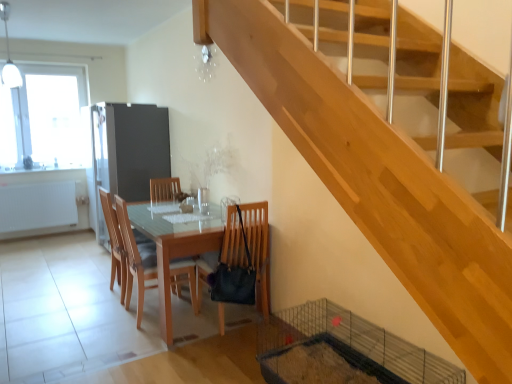
Question: Is wooden chair at center, the 2th chair in the right-to-left sequence, located outside matte wooden table at center?

Choices:
 (A) yes
 (B) no

Answer: (B)

Question: Is wooden chair at center, the 2th chair in the right-to-left sequence, facing away from matte wooden table at center?

Choices:
 (A) yes
 (B) no

Answer: (A)

Question: From a real-world perspective, is wooden chair at center, the 2th chair in the right-to-left sequence, physically below matte wooden table at center?

Choices:
 (A) yes
 (B) no

Answer: (B)

Question: Is wooden chair at center, the 2th chair from the left, far away from matte wooden table at center?

Choices:
 (A) yes
 (B) no

Answer: (B)

Question: Considering the relative sizes of wooden chair at center, the 2th chair in the right-to-left sequence, and matte wooden table at center in the image provided, is wooden chair at center, the 2th chair in the right-to-left sequence, shorter than matte wooden table at center?

Choices:
 (A) yes
 (B) no

Answer: (B)

Question: From a real-world perspective, is wooden chair at center, the 2th chair from the left, physically located above or below transparent glass window at upper left?

Choices:
 (A) above
 (B) below

Answer: (B)

Question: In terms of height, does wooden chair at center, the 2th chair in the right-to-left sequence, look taller or shorter compared to transparent glass window at upper left?

Choices:
 (A) short
 (B) tall

Answer: (A)

Question: Considering the relative positions of wooden chair at center, the 2th chair from the left, and transparent glass window at upper left in the image provided, is wooden chair at center, the 2th chair from the left, to the left or to the right of transparent glass window at upper left?

Choices:
 (A) right
 (B) left

Answer: (A)

Question: Looking at the image, does wooden chair at center, the 2th chair in the right-to-left sequence, seem bigger or smaller compared to transparent glass window at upper left?

Choices:
 (A) big
 (B) small

Answer: (B)

Question: Would you say wooden chair at center, which is counted as the third chair, starting from the right, is to the left or to the right of metallic silver screen door at center left in the picture?

Choices:
 (A) right
 (B) left

Answer: (A)

Question: From a real-world perspective, is wooden chair at center, which is counted as the third chair, starting from the right, positioned above or below metallic silver screen door at center left?

Choices:
 (A) above
 (B) below

Answer: (B)

Question: Considering the positions of point (113, 281) and point (160, 165), is point (113, 281) closer or farther from the camera than point (160, 165)?

Choices:
 (A) farther
 (B) closer

Answer: (B)

Question: Is wooden chair at center, placed as the 1th chair when sorted from left to right, taller or shorter than metallic silver screen door at center left?

Choices:
 (A) tall
 (B) short

Answer: (B)

Question: In terms of height, does wooden chair at center, the 2th chair in the right-to-left sequence, look taller or shorter compared to matte wooden table at center?

Choices:
 (A) short
 (B) tall

Answer: (B)

Question: In terms of size, does wooden chair at center, the 2th chair from the left, appear bigger or smaller than matte wooden table at center?

Choices:
 (A) small
 (B) big

Answer: (A)